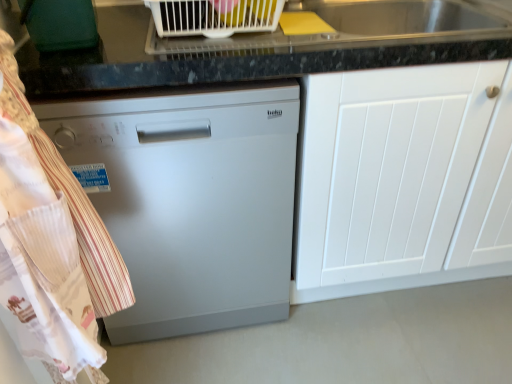
Question: From a real-world perspective, is satin silver dishwasher at center positioned above or below white matte cabinet at center?

Choices:
 (A) below
 (B) above

Answer: (B)

Question: In the image, is satin silver dishwasher at center positioned in front of or behind white matte cabinet at center?

Choices:
 (A) front
 (B) behind

Answer: (A)

Question: Estimate the real-world distances between objects in this image. Which object is closer to the satin silver dishwasher at center?

Choices:
 (A) white matte cabinet at center
 (B) white plastic dish rack at upper center
 (C) white striped fabric at left

Answer: (C)

Question: Based on their relative distances, which object is nearer to the satin silver dishwasher at center?

Choices:
 (A) white striped fabric at left
 (B) white matte cabinet at center
 (C) white plastic dish rack at upper center

Answer: (A)